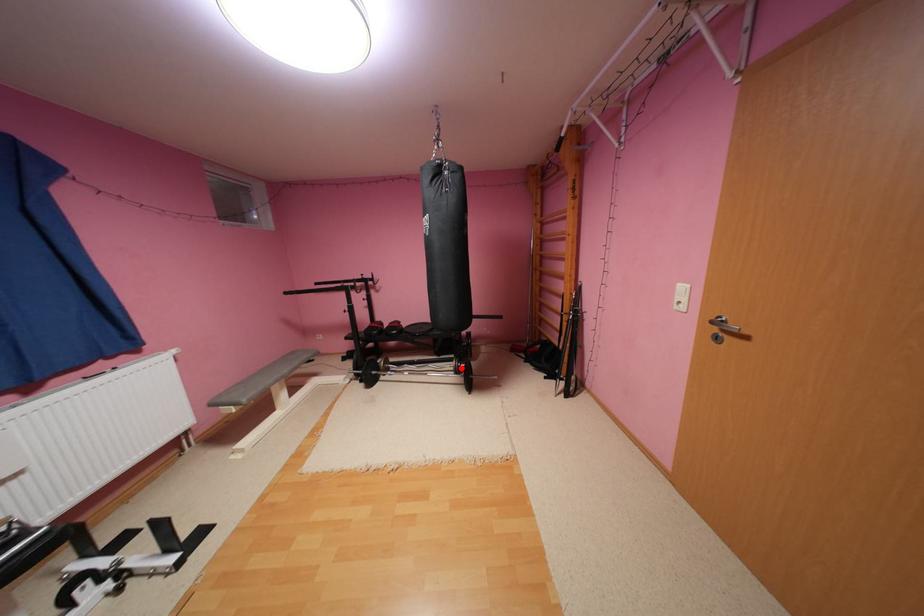
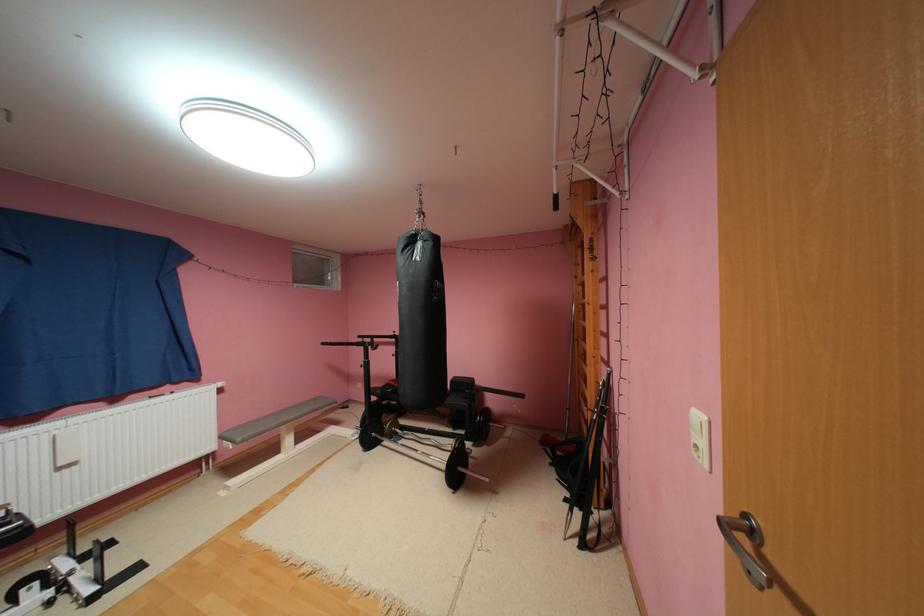
Question: I am providing you with two images of the same scene from different viewpoints. Given a red point in image1, look at the same physical point in image2. Is it:

Choices:
 (A) Closer to the viewpoint
 (B) Farther from the viewpoint

Answer: (A)